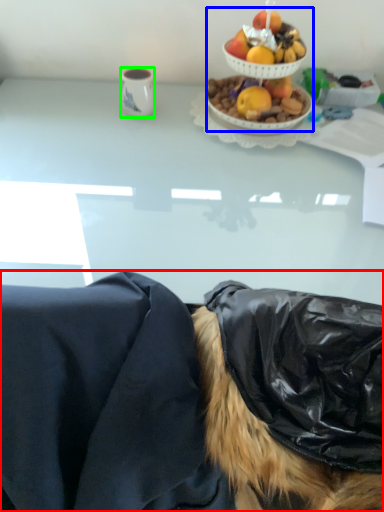
Question: Which object is the closest to the person (highlighted by a red box)? Choose among these: fruit salad (highlighted by a blue box) or coffee cup (highlighted by a green box).

Choices:
 (A) fruit salad
 (B) coffee cup

Answer: (A)